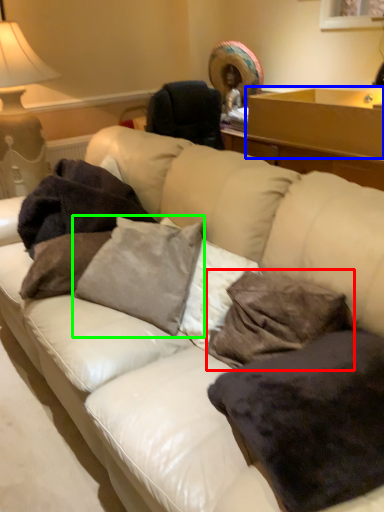
Question: Considering the real-world distances, which object is closest to pillow (highlighted by a red box)? table (highlighted by a blue box) or pillow (highlighted by a green box).

Choices:
 (A) table
 (B) pillow

Answer: (B)